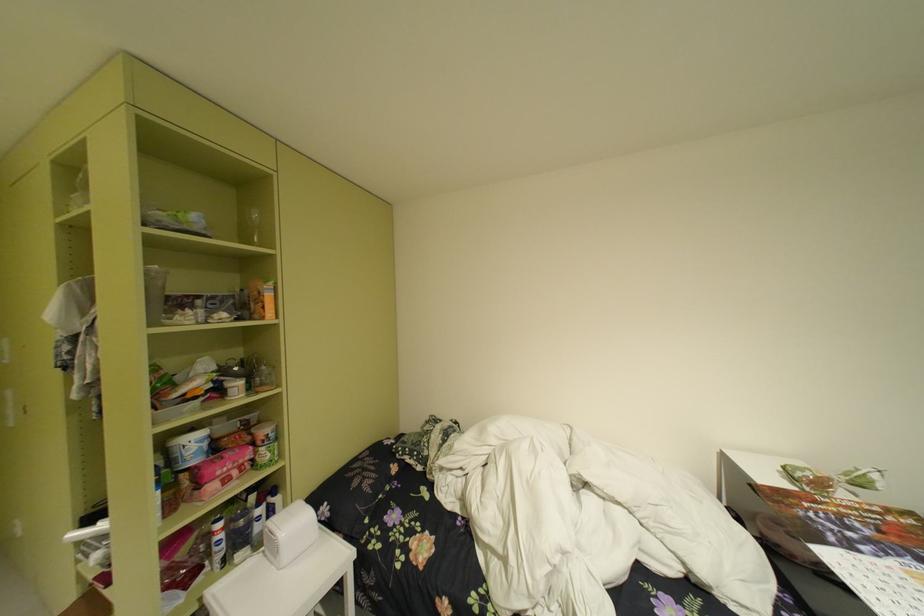
Where is `glass storage jar`? glass storage jar is located at coordinates (238, 535).